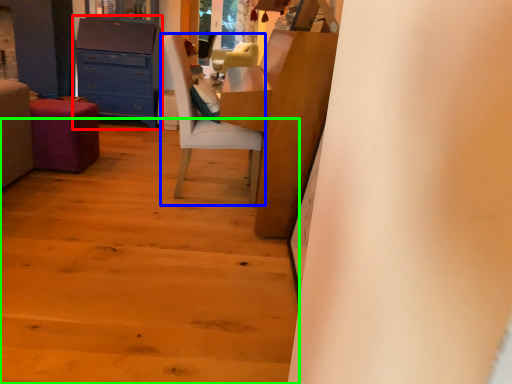
Question: Considering the real-world distances, which object is farthest from chest of drawers (highlighted by a red box)? chair (highlighted by a blue box) or stairwell (highlighted by a green box)?

Choices:
 (A) chair
 (B) stairwell

Answer: (B)